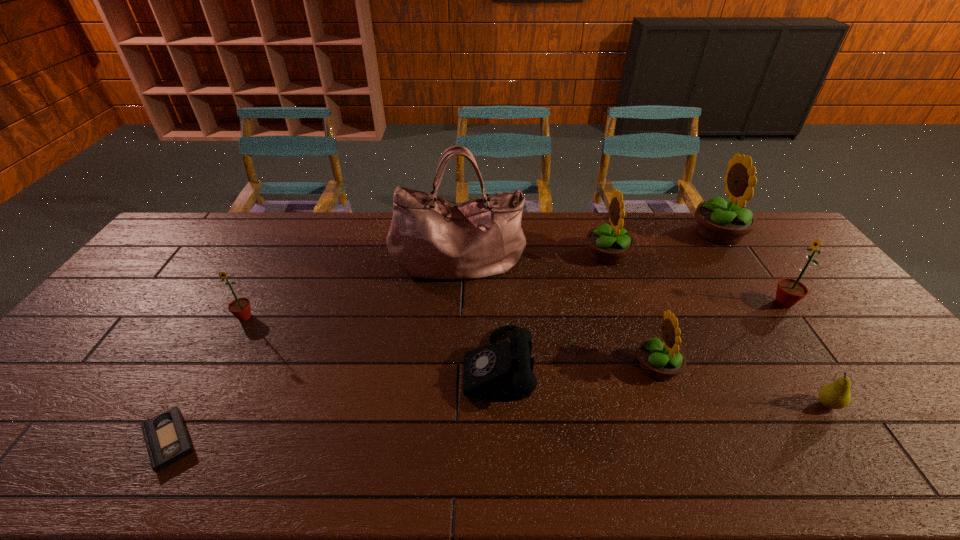
The height and width of the screenshot is (540, 960). What are the coordinates of `telephone` in the screenshot? It's located at (502, 370).

Locate an element on the screen. This screenshot has width=960, height=540. the shortest object is located at coordinates (166, 437).

Where is `vacant position located at the front of the tallest object with handles`? Image resolution: width=960 pixels, height=540 pixels. vacant position located at the front of the tallest object with handles is located at coordinates (454, 341).

The width and height of the screenshot is (960, 540). I want to click on vacant space located 0.280m on the face of the eighth shortest object, so click(x=614, y=233).

The width and height of the screenshot is (960, 540). What are the coordinates of `vacant area located on the face of the eighth shortest object` in the screenshot? It's located at (625, 233).

Locate an element on the screen. Image resolution: width=960 pixels, height=540 pixels. vacant area situated 0.310m on the face of the eighth shortest object is located at coordinates (606, 233).

At what (x,y) coordinates should I click in order to perform the action: click on free space located on the face of the second biggest yellow sunflower. Please return your answer as a coordinate pair (x, y). This screenshot has width=960, height=540. Looking at the image, I should click on (523, 254).

Where is `vacant space located 0.090m on the face of the second biggest yellow sunflower`? Image resolution: width=960 pixels, height=540 pixels. vacant space located 0.090m on the face of the second biggest yellow sunflower is located at coordinates point(558,254).

You are a GUI agent. You are given a task and a screenshot of the screen. Output one action in this format:
    pyautogui.click(x=<x>, y=<y>)
    Task: Click on the free point located on the face of the second biggest yellow sunflower
    Image resolution: width=960 pixels, height=540 pixels.
    Given the screenshot: What is the action you would take?
    pyautogui.click(x=511, y=254)

The height and width of the screenshot is (540, 960). In order to click on free space located 0.050m on the face of the bigger green sunflower in this screenshot , I will do `click(754, 303)`.